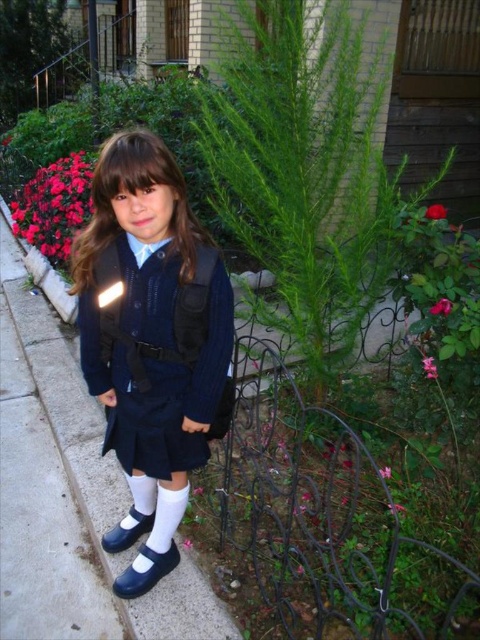
You are a gardener looking at the garden in the image. You see a pink matte flower at center and a pink matte rose at center right. Which one is located higher in the image?

The pink matte flower at center is positioned over the pink matte rose at center right, so it is higher in the image.

You are a gardener who needs to place a new statue between the glossy rose at right and the pink matte flower at center. Which flower should the statue be closer to if it needs to be placed at the same height as the shorter one?

The glossy rose at right is shorter than the pink matte flower at center, so the statue should be placed closer to the glossy rose at right to match its height.

You are standing in the garden and want to reach the point marked as point (117, 156). If you take a step forward of 3 feet, will you reach the point?

The point (117, 156) is 4.16 feet away from the viewer. Taking a step forward of 3 feet would bring you to 1.16 feet away from the point, so yes, you will reach the point.